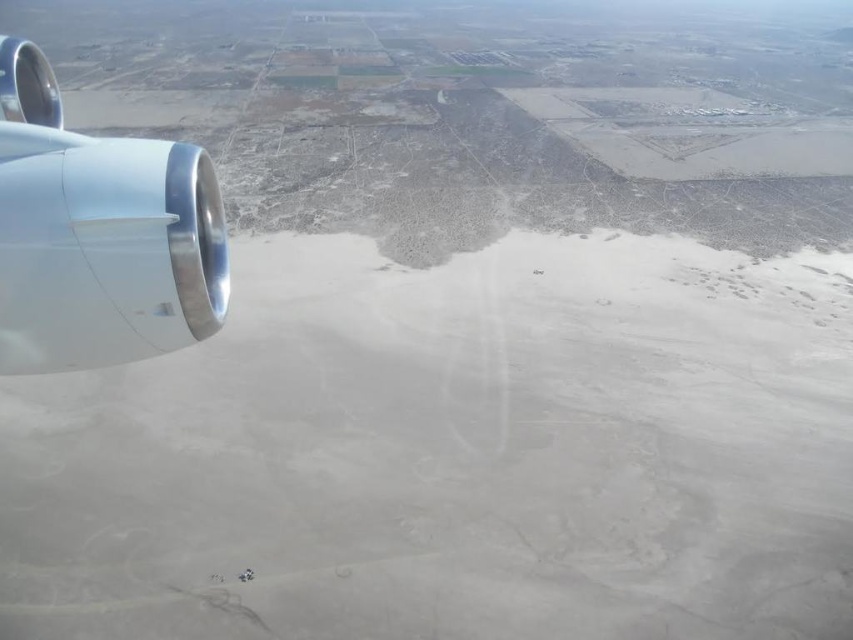
You are a passenger sitting by the window and see the white sand at left and the polished chrome airplane engine at left. Which object is closer to the window side of the airplane?

The polished chrome airplane engine at left is closer to the window side of the airplane because the white sand at left is to the right of it, meaning the engine is positioned further left towards the window.

You are a pilot navigating an airplane. You notice the metallic silver engine at left from your cockpit view. Can you confirm if the engine is positioned closer to the left side of the aircraft compared to the right side?

The metallic silver engine at left is positioned at point (97,234), which indicates it is closer to the left side of the aircraft compared to the right side.

Based on the photo, you are a passenger on the airplane. You look out the window and see the metallic silver engine at left and the polished chrome airplane engine at left. Which engine is closer to you?

The metallic silver engine at left is closer to you because it is in front of the polished chrome airplane engine at left.